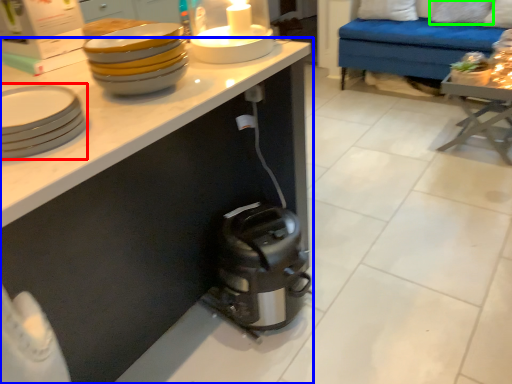
Question: Considering the real-world distances, which object is farthest from tableware (highlighted by a red box)? cabinetry (highlighted by a blue box) or pillow (highlighted by a green box)?

Choices:
 (A) cabinetry
 (B) pillow

Answer: (B)